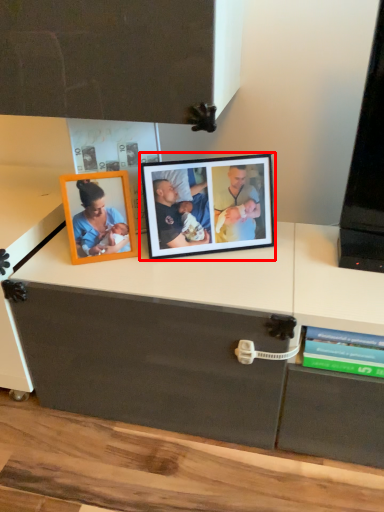
Question: From the image's perspective, what is the correct spatial positioning of picture frame (annotated by the red box) in reference to book?

Choices:
 (A) above
 (B) below

Answer: (A)